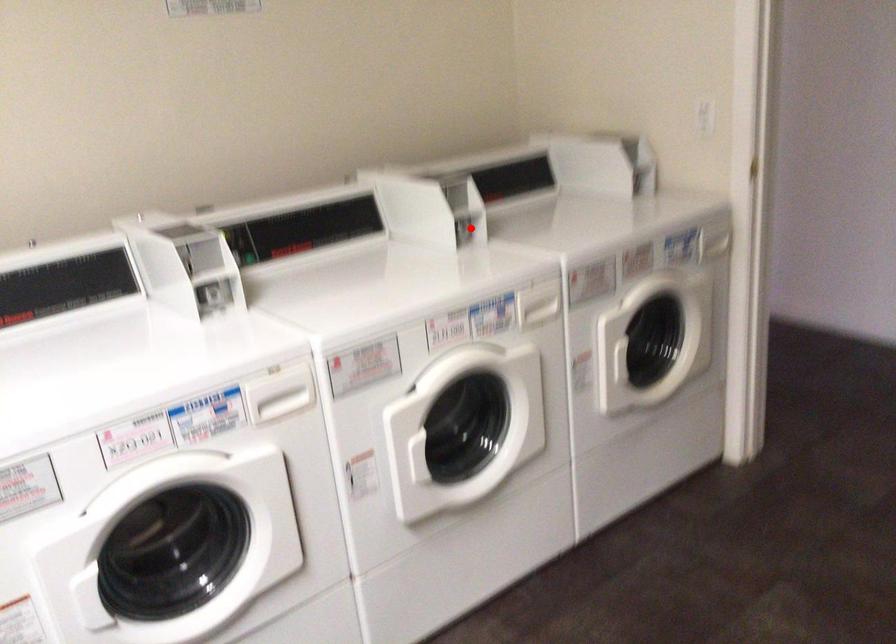
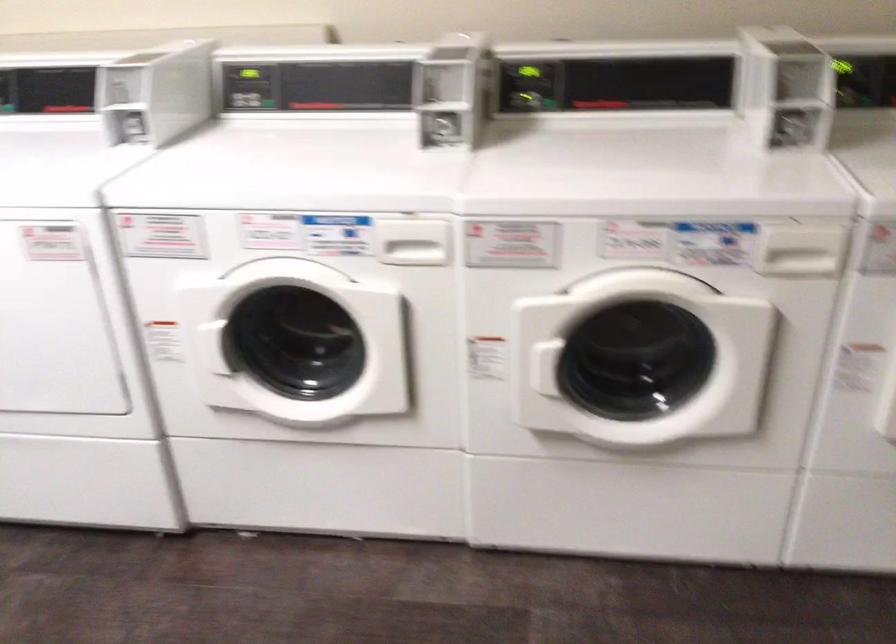
Question: A red point is marked in image1. In image2, is the corresponding 3D point closer to the camera or farther? Reply with the corresponding letter.

Choices:
 (A) The corresponding 3D point is closer.
 (B) The corresponding 3D point is farther.

Answer: (A)